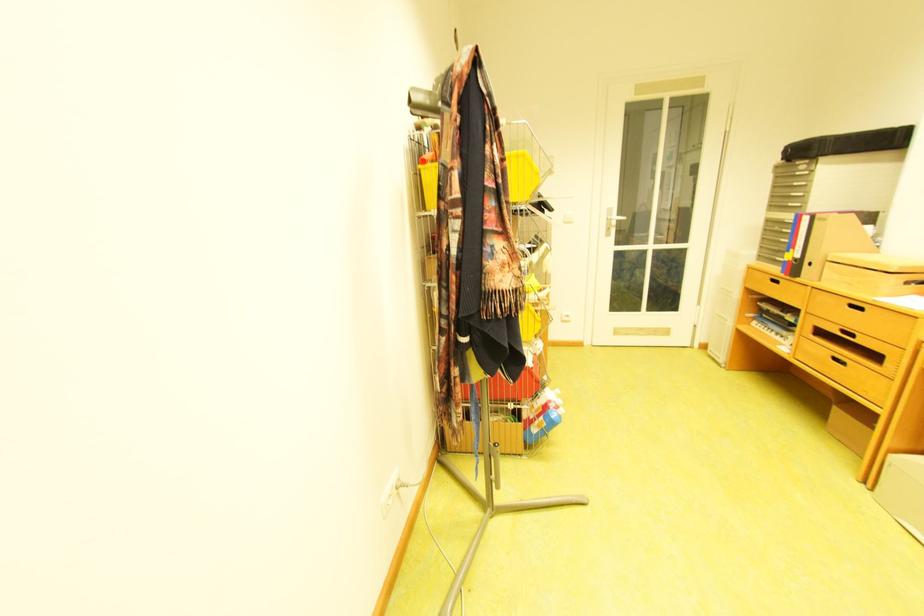
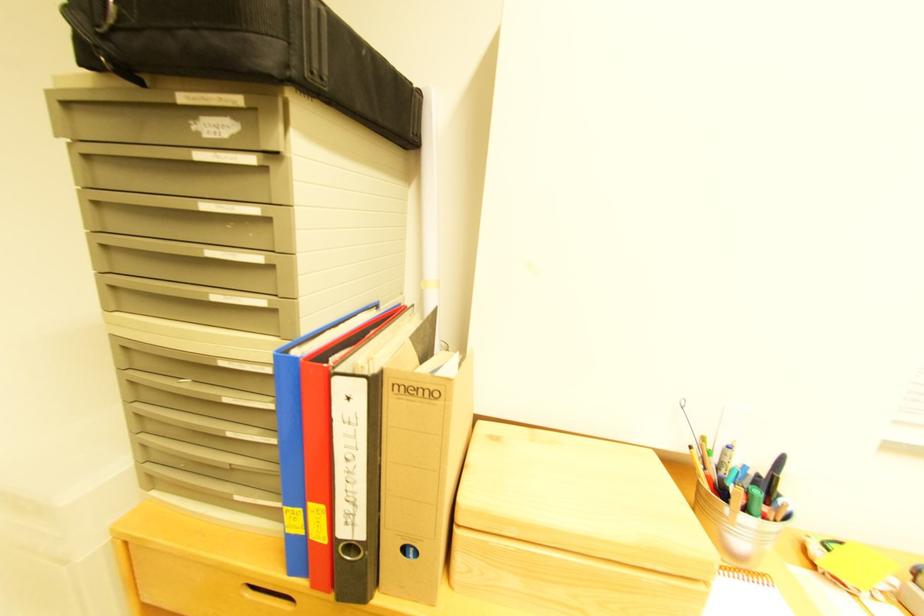
Question: I am providing you with two images of the same scene from different viewpoints. Which of the following objects are not visible in image2?

Choices:
 (A) black bag
 (B) yellow pen
 (C) wooden lidded box
 (D) none of these

Answer: (D)